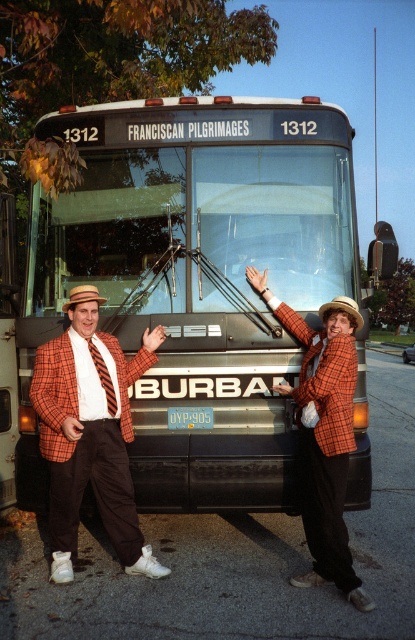
You are standing at the point with coordinates (x=90, y=433) in the image. What object is located at this point?

The orange checkered blazer at center is located at point (x=90, y=433).

You are a photographer trying to capture a photo of both the metallic silver bus at center and the orange checkered blazer at center in the same frame. Based on their distance, can you fit both into your camera viewfinder without moving your position?

The metallic silver bus at center and orange checkered blazer at center are 23.76 inches apart from each other. Since 23.76 inches is a manageable distance for a camera viewfinder, you can fit both into the frame without moving your position.